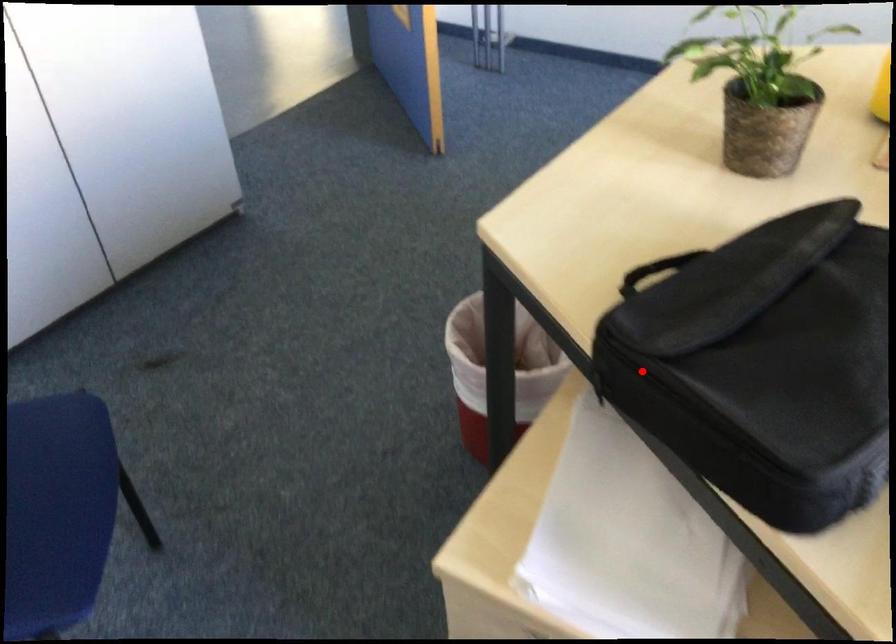
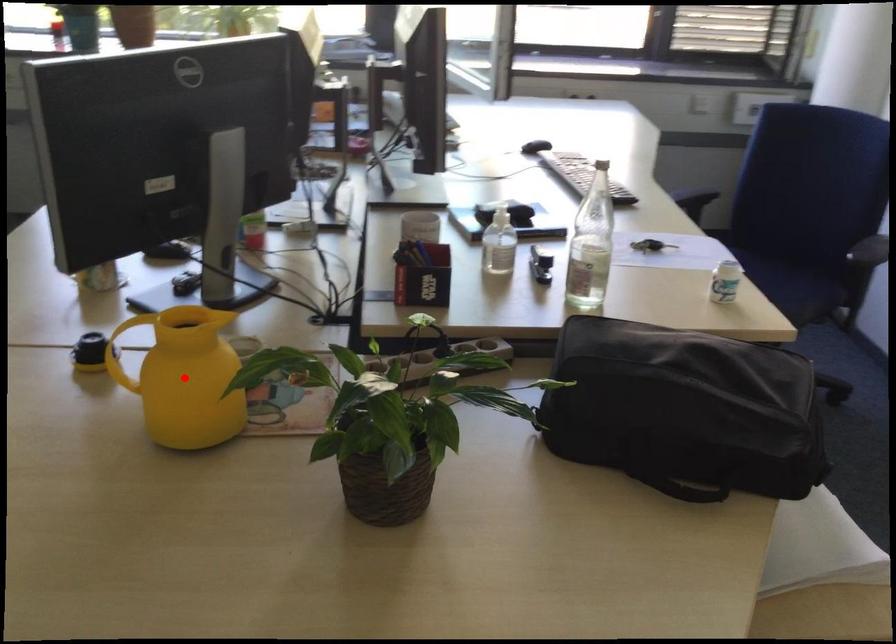
I am providing you with two images of the same scene from different viewpoints. A red point is marked on the first image and another point is marked on the second image. Does the point marked in image1 correspond to the same location as the one in image2?

No